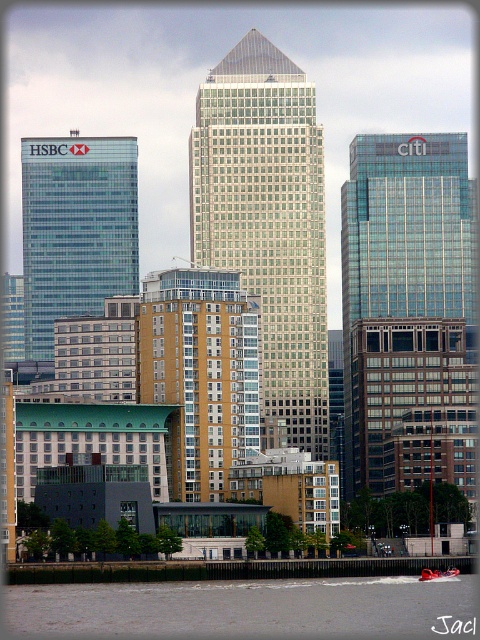
You are a city planner analyzing the urban layout. Given the glassy blue skyscraper at right and the gray concrete waterway at lower left, which one occupies more space in the image?

The glassy blue skyscraper at right is larger in size than the gray concrete waterway at lower left, so it occupies more space in the image.

You are a drone operator who needs to fly a drone between the glassy silver skyscraper at center and the glassy blue skyscraper at right. The drone has a wingspan of 2 meters. Can the drone safely pass through the gap between them?

The distance between the glassy silver skyscraper at center and the glassy blue skyscraper at right is 27.79 meters, which is significantly wider than the drone wingspan of 2 meters. Yes, the drone can safely pass through the gap between them.